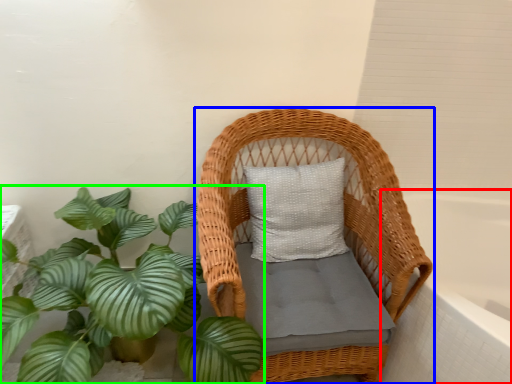
Question: Which is nearer to the bath (highlighted by a red box)? furniture (highlighted by a blue box) or houseplant (highlighted by a green box).

Choices:
 (A) furniture
 (B) houseplant

Answer: (A)